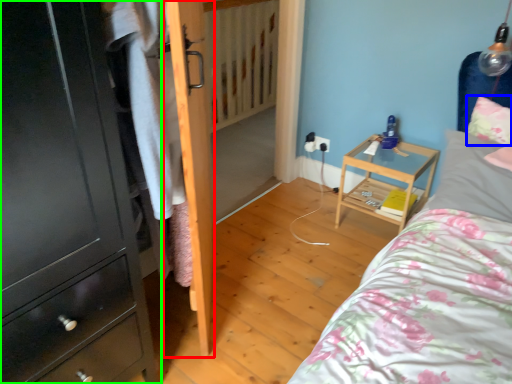
Question: Estimate the real-world distances between objects in this image. Which object is farther from door (highlighted by a red box), pillow (highlighted by a blue box) or chest of drawers (highlighted by a green box)?

Choices:
 (A) pillow
 (B) chest of drawers

Answer: (A)